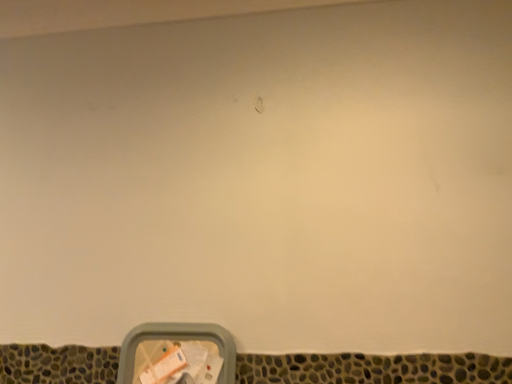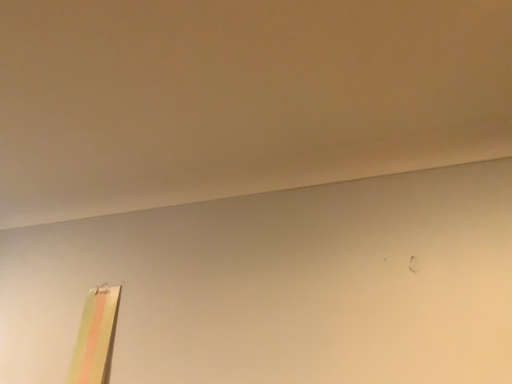
Question: How did the camera likely rotate when shooting the video?

Choices:
 (A) rotated downward
 (B) rotated upward

Answer: (B)